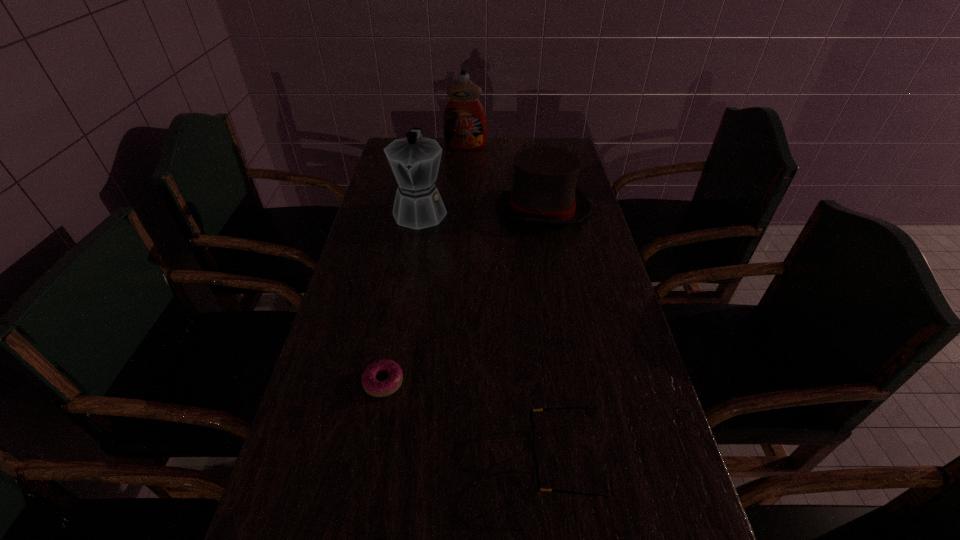
Where is `free space located 0.160m on the front-facing side of the spectacles`? free space located 0.160m on the front-facing side of the spectacles is located at coordinates (447, 458).

This screenshot has width=960, height=540. What are the coordinates of `vacant space situated 0.140m on the front-facing side of the spectacles` in the screenshot? It's located at (458, 458).

Identify the location of vacant position located 0.060m on the front-facing side of the spectacles. This screenshot has height=540, width=960. (500, 458).

Where is `vacant space located 0.060m on the front of the fourth farthest object`? vacant space located 0.060m on the front of the fourth farthest object is located at coordinates (375, 427).

Find the location of a particular element. object positioned at the far edge is located at coordinates (464, 123).

Find the location of `coffeepot that is at the left edge`. coffeepot that is at the left edge is located at coordinates (415, 160).

I want to click on doughnut positioned at the left edge, so click(374, 387).

Identify the location of dress hat that is at the right edge. This screenshot has height=540, width=960. (544, 190).

The width and height of the screenshot is (960, 540). In order to click on spectacles that is at the right edge in this screenshot , I will do `click(535, 469)`.

In the image, there is a desktop. Where is `free region at the far edge`? Image resolution: width=960 pixels, height=540 pixels. free region at the far edge is located at coordinates (502, 141).